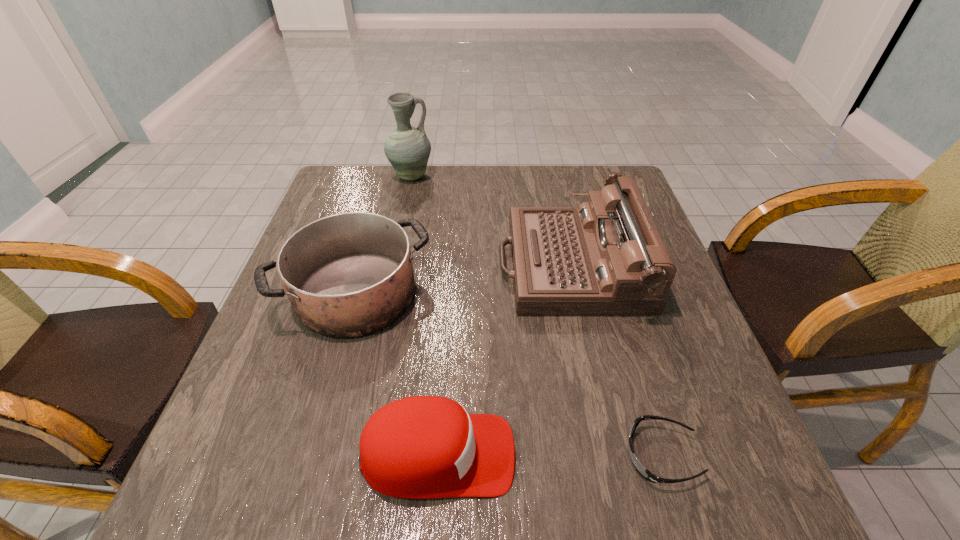
Find the location of `the tallest object`. the tallest object is located at coordinates pos(407,148).

Locate an element on the screen. The image size is (960, 540). the farthest object is located at coordinates (407, 148).

Identify the location of typewriter. The height and width of the screenshot is (540, 960). (606, 257).

Where is `the third shortest object`? the third shortest object is located at coordinates (346, 275).

Find the location of a particular element. The image size is (960, 540). the fourth tallest object is located at coordinates (422, 447).

In order to click on sunglasses in this screenshot , I will do `click(645, 473)`.

Locate an element on the screen. vacant area situated 0.290m on the handle side of the farthest object is located at coordinates (527, 176).

Where is `vacant position located 0.050m on the keyboard of the typewriter`? vacant position located 0.050m on the keyboard of the typewriter is located at coordinates (479, 265).

At what (x,y) coordinates should I click in order to perform the action: click on vacant space located 0.200m on the keyboard of the typewriter. Please return your answer as a coordinate pair (x, y). The image size is (960, 540). Looking at the image, I should click on (418, 265).

The height and width of the screenshot is (540, 960). I want to click on vacant space located on the keyboard of the typewriter, so click(x=344, y=265).